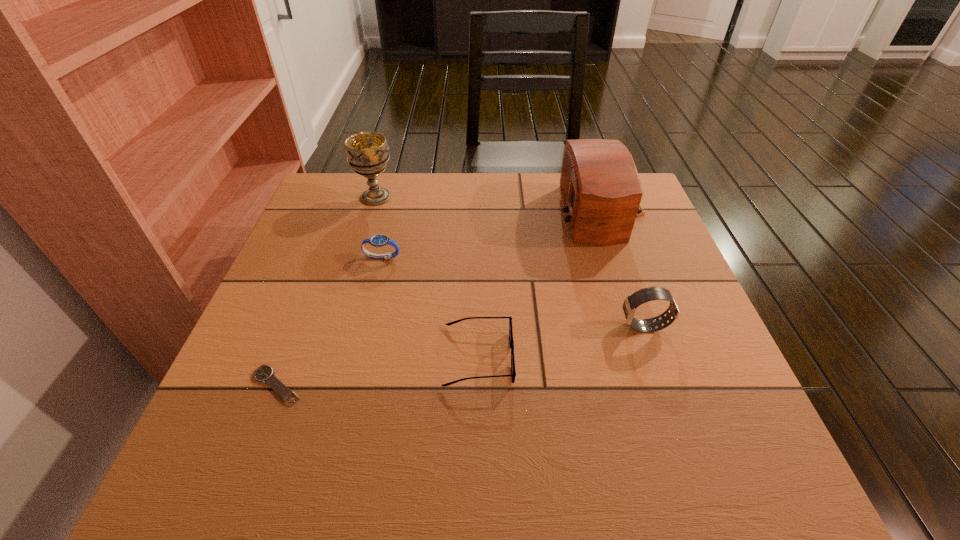
Find the location of a particular element. The image size is (960, 540). radio receiver is located at coordinates (601, 190).

The height and width of the screenshot is (540, 960). What are the coordinates of `chalice` in the screenshot? It's located at (367, 152).

This screenshot has height=540, width=960. I want to click on the tallest watch, so click(644, 295).

Locate an element on the screen. the fourth shortest object is located at coordinates (644, 295).

The width and height of the screenshot is (960, 540). Identify the location of the second shortest watch. (380, 240).

Find the location of a particular element. This screenshot has width=960, height=540. the fourth tallest object is located at coordinates click(x=380, y=240).

This screenshot has width=960, height=540. In order to click on the fourth object from left to right in this screenshot , I will do `click(513, 373)`.

The width and height of the screenshot is (960, 540). Identify the location of the second shortest object. (513, 373).

Find the location of a particular element. the shortest object is located at coordinates (265, 374).

The image size is (960, 540). Identify the location of the shortest watch. (265, 374).